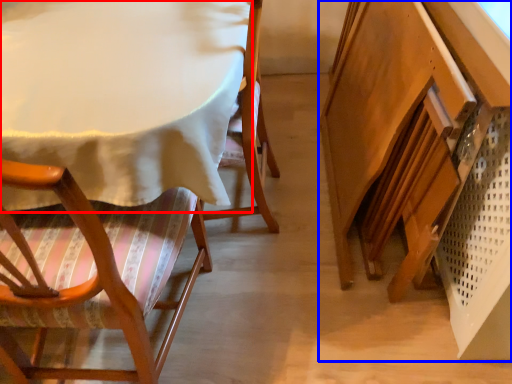
Question: Among these objects, which one is nearest to the camera, table (highlighted by a red box) or vanity (highlighted by a blue box)?

Choices:
 (A) table
 (B) vanity

Answer: (B)